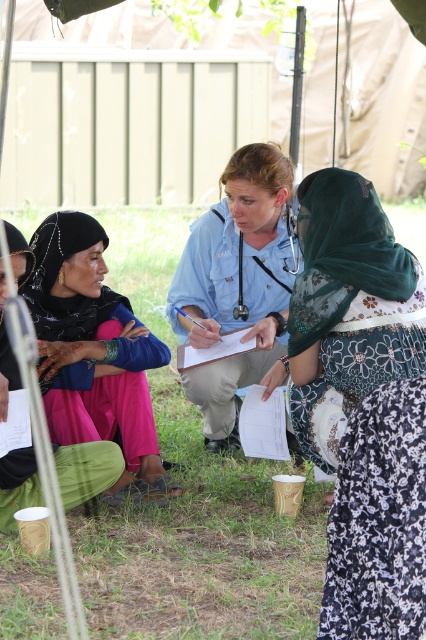
Image resolution: width=426 pixels, height=640 pixels. What do you see at coordinates (193, 499) in the screenshot?
I see `green grass at center` at bounding box center [193, 499].

Can you confirm if green grass at center is wider than blue uniform at center?

Indeed, green grass at center has a greater width compared to blue uniform at center.

I want to click on green grass at center, so pyautogui.click(x=193, y=499).

Locate an element on the screen. green grass at center is located at coordinates (193, 499).

Can you confirm if green grass at center is taller than metallic blue stethoscope at center?

Indeed, green grass at center has a greater height compared to metallic blue stethoscope at center.

Does green grass at center lie in front of metallic blue stethoscope at center?

Yes, it is in front of metallic blue stethoscope at center.

Identify the location of green grass at center. (193, 499).

From the picture: Which is more to the left, matte pink dress at lower left or white paper clipboard at center?

matte pink dress at lower left is more to the left.

Is point (97, 308) closer to viewer compared to point (204, 362)?

That is True.

The image size is (426, 640). Find the location of `matte pink dress at lower left`. matte pink dress at lower left is located at coordinates (92, 348).